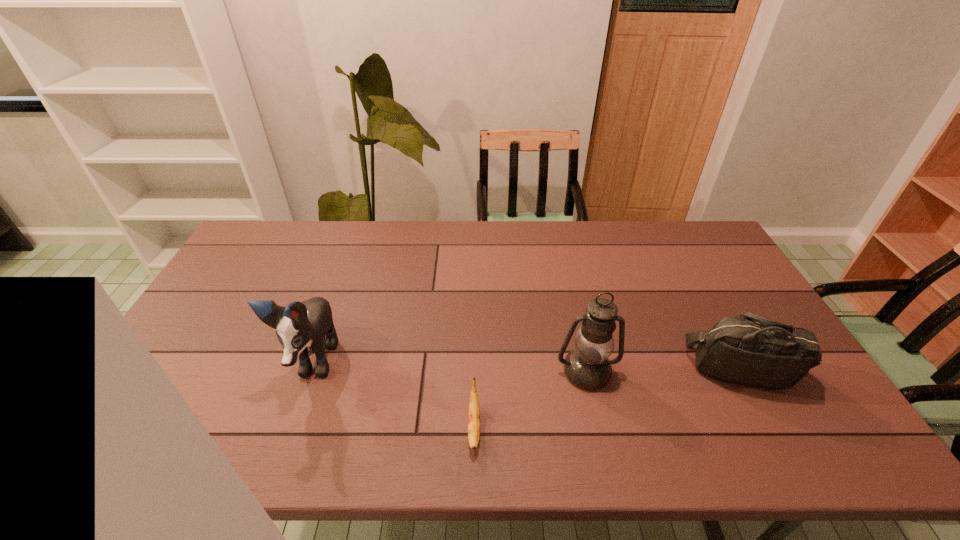
Identify the location of free space between the third object from right to left and the puppy. The height and width of the screenshot is (540, 960). (394, 395).

This screenshot has width=960, height=540. What are the coordinates of `empty location between the second shortest object and the second object from left to right` in the screenshot? It's located at (608, 398).

Identify the location of vacant area between the shortest object and the second shortest object. The width and height of the screenshot is (960, 540). (608, 398).

Where is `vacant point located between the oil lamp and the second object from left to right`? Image resolution: width=960 pixels, height=540 pixels. vacant point located between the oil lamp and the second object from left to right is located at coordinates (530, 399).

The image size is (960, 540). Identify the location of empty location between the second object from right to left and the shoulder bag. [x=663, y=370].

Locate an element on the screen. vacant space that is in between the leftmost object and the shoulder bag is located at coordinates (527, 366).

Choose which object is the second nearest neighbor to the rightmost object. Please provide its 2D coordinates. Your answer should be formatted as a tuple, i.e. [(x, y)], where the tuple contains the x and y coordinates of a point satisfying the conditions above.

[(474, 410)]

You are a GUI agent. You are given a task and a screenshot of the screen. Output one action in this format:
    pyautogui.click(x=<x>, y=<y>)
    Task: Click on the object that stands as the closest to the puppy
    The height and width of the screenshot is (540, 960).
    Given the screenshot: What is the action you would take?
    pyautogui.click(x=474, y=410)

Find the location of `free space that satisfies the following two spatial constraints: 1. on the front-facing side of the puppy; 2. on the right side of the third object from left to right`. free space that satisfies the following two spatial constraints: 1. on the front-facing side of the puppy; 2. on the right side of the third object from left to right is located at coordinates (310, 372).